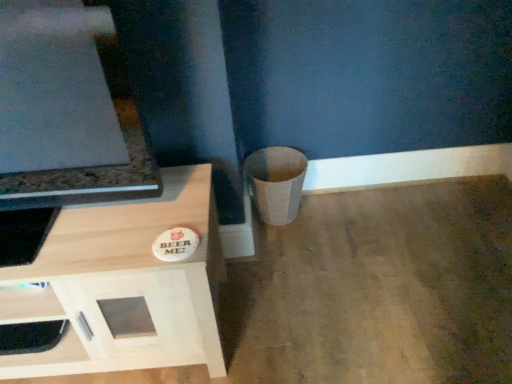
Locate an element on the screen. empty space that is ontop of light wood cabinet at lower left (from a real-world perspective) is located at coordinates (87, 228).